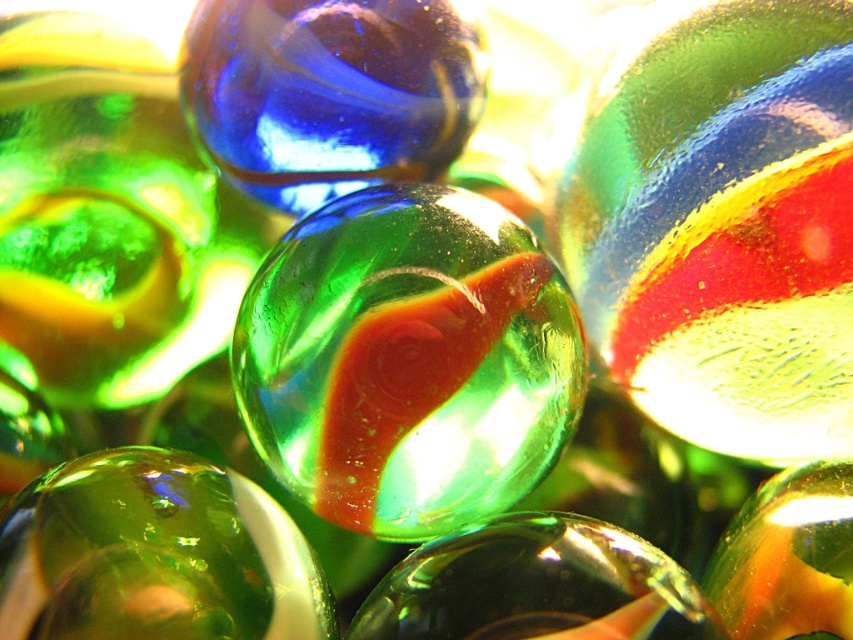
Question: Which object appears farthest from the camera in this image?

Choices:
 (A) green glossy marble at center
 (B) transparent blue glass bead at center
 (C) green translucent sphere at center

Answer: (B)

Question: Is green translucent marble at center to the left of transparent blue glass bead at center from the viewer's perspective?

Choices:
 (A) yes
 (B) no

Answer: (B)

Question: Can you confirm if green translucent marble at center is positioned above transparent blue glass bead at center?

Choices:
 (A) no
 (B) yes

Answer: (A)

Question: Can you confirm if green translucent marble at center is positioned to the left of green translucent sphere at center?

Choices:
 (A) yes
 (B) no

Answer: (B)

Question: Which object is farther from the camera taking this photo?

Choices:
 (A) green translucent marble at center
 (B) green translucent sphere at center

Answer: (A)

Question: Which is farther from the green translucent sphere at center?

Choices:
 (A) transparent blue glass bead at center
 (B) green translucent marble at center
 (C) green glossy marble at center

Answer: (A)